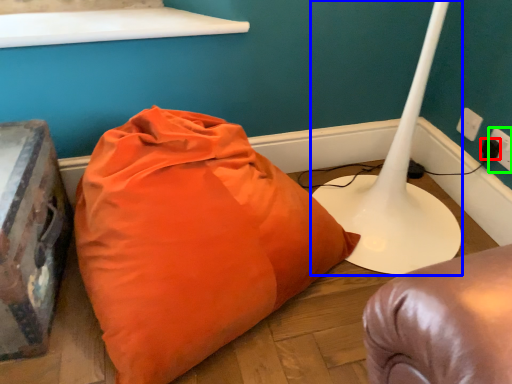
Question: Considering the real-world distances, which object is farthest from plug (highlighted by a red box)? table lamp (highlighted by a blue box) or electric outlet (highlighted by a green box)?

Choices:
 (A) table lamp
 (B) electric outlet

Answer: (A)